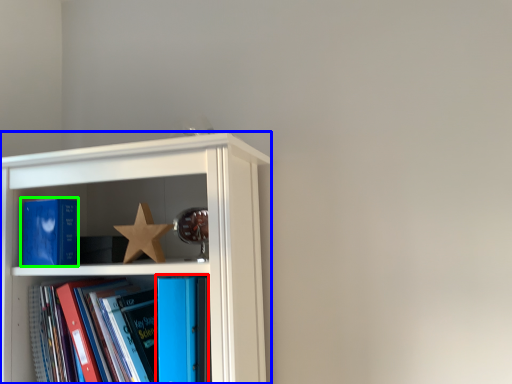
Question: Which object is the farthest from book (highlighted by a red box)? Choose among these: shelf (highlighted by a blue box) or book (highlighted by a green box).

Choices:
 (A) shelf
 (B) book

Answer: (B)